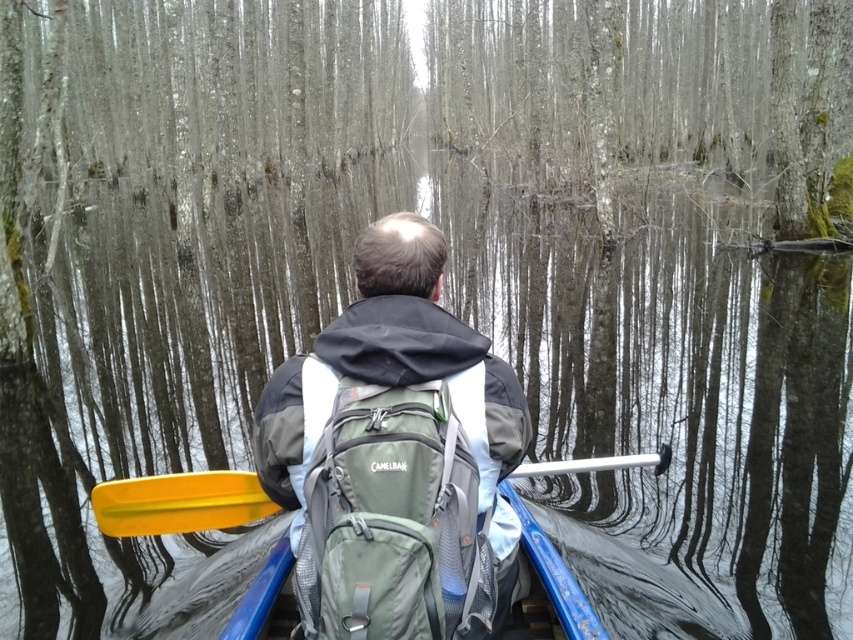
Can you confirm if green fabric backpack at center is shorter than blue plastic canoe at center?

In fact, green fabric backpack at center may be taller than blue plastic canoe at center.

Can you confirm if green fabric backpack at center is taller than blue plastic canoe at center?

Indeed, green fabric backpack at center has a greater height compared to blue plastic canoe at center.

Identify the location of green fabric backpack at center. (393, 522).

What do you see at coordinates (393, 522) in the screenshot? The width and height of the screenshot is (853, 640). I see `green fabric backpack at center` at bounding box center [393, 522].

Between point (329, 465) and point (224, 512), which one is positioned behind?

Positioned behind is point (224, 512).

Locate an element on the screen. The image size is (853, 640). green fabric backpack at center is located at coordinates (393, 522).

Who is lower down, yellow plastic paddle at lower left or blue plastic canoe at center?

blue plastic canoe at center is lower down.

Can you confirm if yellow plastic paddle at lower left is positioned below blue plastic canoe at center?

No.

Who is more forward, (172,515) or (253,620)?

Positioned in front is point (253,620).

Where is `yellow plastic paddle at lower left`? yellow plastic paddle at lower left is located at coordinates (178, 502).